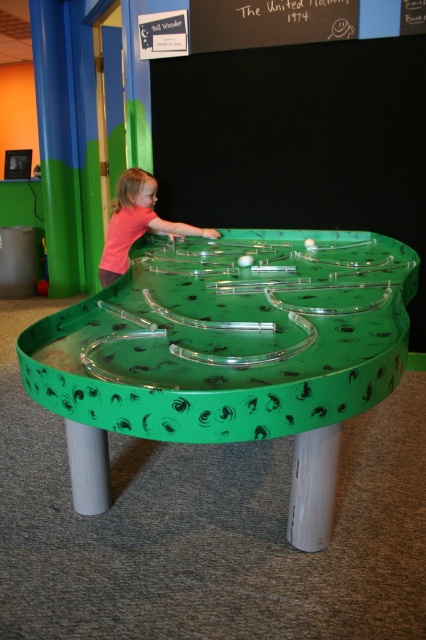
Question: Is green glossy table at center wider than pink matte shirt at upper left?

Choices:
 (A) yes
 (B) no

Answer: (A)

Question: From the image, what is the correct spatial relationship of green glossy table at center in relation to pink matte shirt at upper left?

Choices:
 (A) right
 (B) left

Answer: (A)

Question: Which object appears closest to the camera in this image?

Choices:
 (A) green glossy table at center
 (B) pink matte shirt at upper left

Answer: (A)

Question: Is green glossy table at center smaller than pink matte shirt at upper left?

Choices:
 (A) yes
 (B) no

Answer: (B)

Question: Which point is closer to the camera?

Choices:
 (A) (135, 179)
 (B) (109, 296)

Answer: (B)